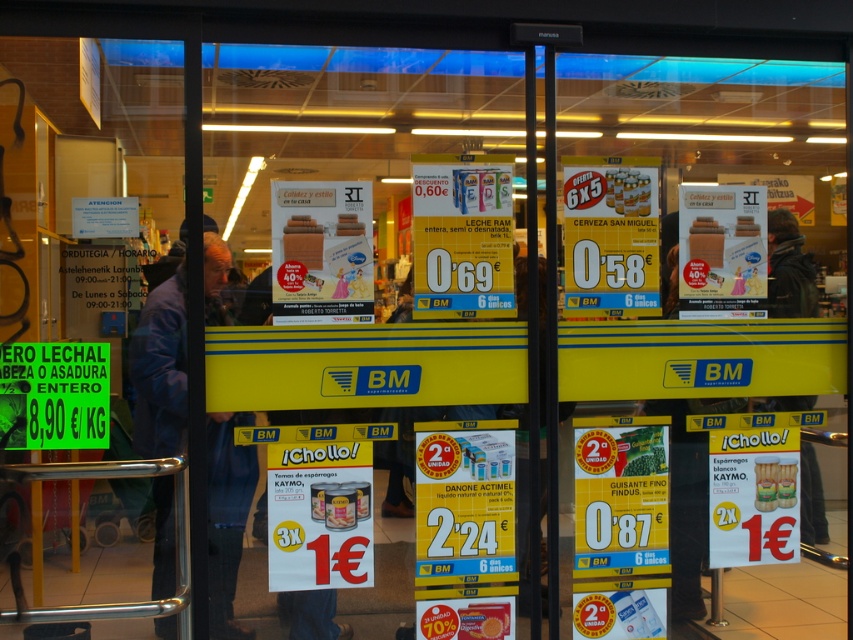
You are a customer entering the supermarket and see the transparent glass door at left and the dark blue jacket at left. Which object is closer to you as you approach the entrance?

The transparent glass door at left is closer to you because it is in front of the dark blue jacket at left.